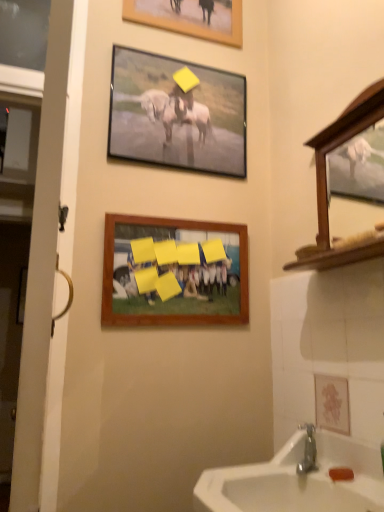
Image resolution: width=384 pixels, height=512 pixels. Identify the location of wooden picture frame at upper center, placed as the first picture frame when sorted from top to bottom. (190, 18).

Locate an element on the screen. The width and height of the screenshot is (384, 512). metallic silver frame at upper center, positioned as the 2th picture frame in top-to-bottom order is located at coordinates (176, 114).

What do you see at coordinates (297, 480) in the screenshot? I see `white ceramic sink at lower right` at bounding box center [297, 480].

What are the coordinates of `wooden picture frame at center, which is counted as the first picture frame, starting from the bottom` in the screenshot? It's located at (174, 272).

Identify the location of wooden picture frame at upper center, placed as the first picture frame when sorted from top to bottom. This screenshot has height=512, width=384. (190, 18).

Between wooden picture frame at center, positioned as the 3th picture frame in top-to-bottom order, and wooden picture frame at upper center, marked as the third picture frame in a bottom-to-top arrangement, which one has smaller size?

Smaller between the two is wooden picture frame at upper center, marked as the third picture frame in a bottom-to-top arrangement.

Does wooden picture frame at center, positioned as the 3th picture frame in top-to-bottom order, turn towards wooden picture frame at upper center, placed as the first picture frame when sorted from top to bottom?

No, wooden picture frame at center, positioned as the 3th picture frame in top-to-bottom order, does not turn towards wooden picture frame at upper center, placed as the first picture frame when sorted from top to bottom.

Does wooden picture frame at center, which is counted as the first picture frame, starting from the bottom, appear on the right side of wooden picture frame at upper center, marked as the third picture frame in a bottom-to-top arrangement?

No.

Which is behind, point (104, 268) or point (211, 7)?

The point (211, 7) is farther from the camera.

From the image's perspective, which object appears higher, wooden picture frame at upper center, marked as the third picture frame in a bottom-to-top arrangement, or white ceramic sink at lower right?

wooden picture frame at upper center, marked as the third picture frame in a bottom-to-top arrangement, from the image's perspective.

In the image, is wooden picture frame at upper center, marked as the third picture frame in a bottom-to-top arrangement, positioned in front of or behind white ceramic sink at lower right?

In the image, wooden picture frame at upper center, marked as the third picture frame in a bottom-to-top arrangement, appears behind white ceramic sink at lower right.

Considering the points (167, 9) and (301, 497), which point is in front, point (167, 9) or point (301, 497)?

Point (301, 497)

Locate an element on the screen. sink below the wooden picture frame at upper center, marked as the third picture frame in a bottom-to-top arrangement (from the image's perspective) is located at coordinates (297, 480).

Is wooden picture frame at upper center, placed as the first picture frame when sorted from top to bottom, inside the boundaries of metallic silver frame at upper center, which is the 2th picture frame from bottom to top, or outside?

wooden picture frame at upper center, placed as the first picture frame when sorted from top to bottom, exists outside the volume of metallic silver frame at upper center, which is the 2th picture frame from bottom to top.

What's the angular difference between wooden picture frame at upper center, placed as the first picture frame when sorted from top to bottom, and metallic silver frame at upper center, which is the 2th picture frame from bottom to top,'s facing directions?

The angular difference between wooden picture frame at upper center, placed as the first picture frame when sorted from top to bottom, and metallic silver frame at upper center, which is the 2th picture frame from bottom to top, is 0.719 degrees.

Considering the relative sizes of wooden picture frame at upper center, marked as the third picture frame in a bottom-to-top arrangement, and metallic silver frame at upper center, positioned as the 2th picture frame in top-to-bottom order, in the image provided, is wooden picture frame at upper center, marked as the third picture frame in a bottom-to-top arrangement, bigger than metallic silver frame at upper center, positioned as the 2th picture frame in top-to-bottom order,?

No.

In the image, is wooden picture frame at upper center, marked as the third picture frame in a bottom-to-top arrangement, on the left side or the right side of metallic silver frame at upper center, which is the 2th picture frame from bottom to top?

wooden picture frame at upper center, marked as the third picture frame in a bottom-to-top arrangement, is to the right of metallic silver frame at upper center, which is the 2th picture frame from bottom to top.

Is white ceramic sink at lower right further to camera compared to metallic silver frame at upper center, positioned as the 2th picture frame in top-to-bottom order?

No.

Is white ceramic sink at lower right facing away from metallic silver frame at upper center, positioned as the 2th picture frame in top-to-bottom order?

No, white ceramic sink at lower right is not facing the opposite direction of metallic silver frame at upper center, positioned as the 2th picture frame in top-to-bottom order.

Are white ceramic sink at lower right and metallic silver frame at upper center, positioned as the 2th picture frame in top-to-bottom order, far apart?

That's right, there is a large distance between white ceramic sink at lower right and metallic silver frame at upper center, positioned as the 2th picture frame in top-to-bottom order.

Consider the image. Could you measure the distance between white ceramic sink at lower right and metallic silver frame at upper center, positioned as the 2th picture frame in top-to-bottom order?

A distance of 1.07 meters exists between white ceramic sink at lower right and metallic silver frame at upper center, positioned as the 2th picture frame in top-to-bottom order.

Is white ceramic sink at lower right located within wooden picture frame at center, positioned as the 3th picture frame in top-to-bottom order?

Actually, white ceramic sink at lower right is outside wooden picture frame at center, positioned as the 3th picture frame in top-to-bottom order.

At what (x,y) coordinates should I click in order to perform the action: click on sink below the wooden picture frame at center, positioned as the 3th picture frame in top-to-bottom order (from the image's perspective). Please return your answer as a coordinate pair (x, y). This screenshot has width=384, height=512. Looking at the image, I should click on (297, 480).

Visually, is wooden picture frame at center, positioned as the 3th picture frame in top-to-bottom order, positioned to the left or to the right of white ceramic sink at lower right?

From the image, it's evident that wooden picture frame at center, positioned as the 3th picture frame in top-to-bottom order, is to the left of white ceramic sink at lower right.

Can you confirm if wooden picture frame at center, which is counted as the first picture frame, starting from the bottom, is wider than white ceramic sink at lower right?

No.

From the image's perspective, is metallic silver frame at upper center, which is the 2th picture frame from bottom to top, located above white ceramic sink at lower right?

Yes, from the image's perspective, metallic silver frame at upper center, which is the 2th picture frame from bottom to top, is on top of white ceramic sink at lower right.

Who is shorter, metallic silver frame at upper center, which is the 2th picture frame from bottom to top, or white ceramic sink at lower right?

white ceramic sink at lower right is shorter.

From a real-world perspective, which object stands above the other?

From a 3D spatial view, metallic silver frame at upper center, which is the 2th picture frame from bottom to top, is above.

Which is behind, metallic silver frame at upper center, which is the 2th picture frame from bottom to top, or white ceramic sink at lower right?

metallic silver frame at upper center, which is the 2th picture frame from bottom to top.

Based on the photo, are white ceramic sink at lower right and white wooden door at left located far from each other?

Actually, white ceramic sink at lower right and white wooden door at left are a little close together.

Is white wooden door at left at the back of white ceramic sink at lower right?

white ceramic sink at lower right is not turned away from white wooden door at left.

What's the angular difference between white ceramic sink at lower right and white wooden door at left's facing directions?

The angular difference between white ceramic sink at lower right and white wooden door at left is 1.11 degrees.

Find the location of `picture frame that is the 2nd one below the wooden picture frame at upper center, placed as the first picture frame when sorted from top to bottom (from a real-world perspective)`. picture frame that is the 2nd one below the wooden picture frame at upper center, placed as the first picture frame when sorted from top to bottom (from a real-world perspective) is located at coordinates (174, 272).

This screenshot has height=512, width=384. Identify the location of the 3rd picture frame positioned above the white ceramic sink at lower right (from the image's perspective). [190, 18].

Which object lies further to the anchor point white wooden door at left, wooden picture frame at upper center, placed as the first picture frame when sorted from top to bottom, or white ceramic sink at lower right?

wooden picture frame at upper center, placed as the first picture frame when sorted from top to bottom, lies further to white wooden door at left than the other object.

Considering their positions, is metallic silver frame at upper center, positioned as the 2th picture frame in top-to-bottom order, positioned further to wooden picture frame at upper center, marked as the third picture frame in a bottom-to-top arrangement, than wooden picture frame at center, which is counted as the first picture frame, starting from the bottom?

wooden picture frame at center, which is counted as the first picture frame, starting from the bottom.

When comparing their distances from wooden picture frame at upper center, placed as the first picture frame when sorted from top to bottom, does wooden picture frame at center, positioned as the 3th picture frame in top-to-bottom order, or white wooden door at left seem further?

The object further to wooden picture frame at upper center, placed as the first picture frame when sorted from top to bottom, is white wooden door at left.

Considering their positions, is wooden picture frame at upper center, marked as the third picture frame in a bottom-to-top arrangement, positioned further to white ceramic sink at lower right than metallic silver frame at upper center, which is the 2th picture frame from bottom to top?

Among the two, wooden picture frame at upper center, marked as the third picture frame in a bottom-to-top arrangement, is located further to white ceramic sink at lower right.

Looking at the image, which one is located further to white ceramic sink at lower right, wooden picture frame at upper center, marked as the third picture frame in a bottom-to-top arrangement, or white wooden door at left?

Among the two, wooden picture frame at upper center, marked as the third picture frame in a bottom-to-top arrangement, is located further to white ceramic sink at lower right.

Considering their positions, is white wooden door at left positioned closer to metallic silver frame at upper center, which is the 2th picture frame from bottom to top, than wooden picture frame at upper center, placed as the first picture frame when sorted from top to bottom?

wooden picture frame at upper center, placed as the first picture frame when sorted from top to bottom, is positioned closer to the anchor metallic silver frame at upper center, which is the 2th picture frame from bottom to top.

Estimate the real-world distances between objects in this image. Which object is closer to wooden picture frame at upper center, placed as the first picture frame when sorted from top to bottom, wooden picture frame at center, positioned as the 3th picture frame in top-to-bottom order, or white ceramic sink at lower right?

Based on the image, wooden picture frame at center, positioned as the 3th picture frame in top-to-bottom order, appears to be nearer to wooden picture frame at upper center, placed as the first picture frame when sorted from top to bottom.

Considering their positions, is wooden picture frame at center, which is counted as the first picture frame, starting from the bottom, positioned closer to white wooden door at left than white ceramic sink at lower right?

Among the two, white ceramic sink at lower right is located nearer to white wooden door at left.

Where is `picture frame positioned between white wooden door at left and metallic silver frame at upper center, positioned as the 2th picture frame in top-to-bottom order, from near to far`? The width and height of the screenshot is (384, 512). picture frame positioned between white wooden door at left and metallic silver frame at upper center, positioned as the 2th picture frame in top-to-bottom order, from near to far is located at coordinates (x=174, y=272).

Image resolution: width=384 pixels, height=512 pixels. I want to click on door between wooden picture frame at upper center, marked as the third picture frame in a bottom-to-top arrangement, and white ceramic sink at lower right vertically, so click(x=40, y=253).

Find the location of `picture frame between metallic silver frame at upper center, which is the 2th picture frame from bottom to top, and white ceramic sink at lower right, in the vertical direction`. picture frame between metallic silver frame at upper center, which is the 2th picture frame from bottom to top, and white ceramic sink at lower right, in the vertical direction is located at coordinates (174, 272).

I want to click on door that lies between metallic silver frame at upper center, positioned as the 2th picture frame in top-to-bottom order, and white ceramic sink at lower right from top to bottom, so click(40, 253).